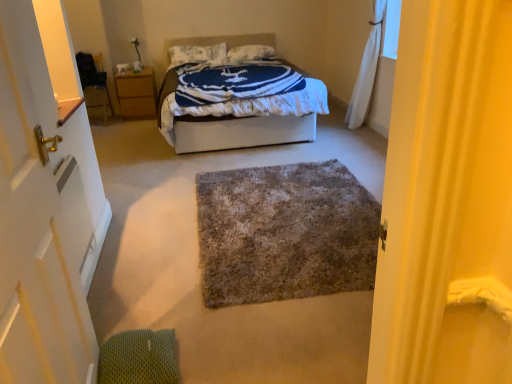
Find the location of a particular element. The image size is (512, 384). vacant region to the left of white sheer curtain at upper right is located at coordinates (329, 137).